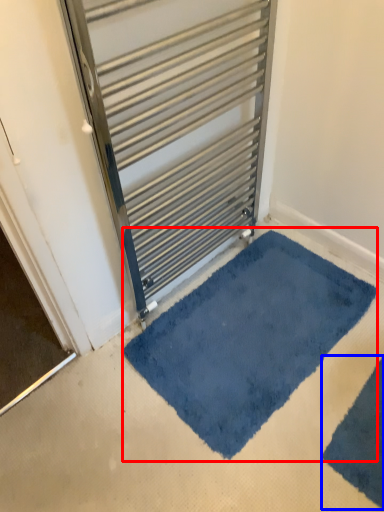
Question: Among these objects, which one is farthest to the camera, bath mat (highlighted by a red box) or bath mat (highlighted by a blue box)?

Choices:
 (A) bath mat
 (B) bath mat

Answer: (A)